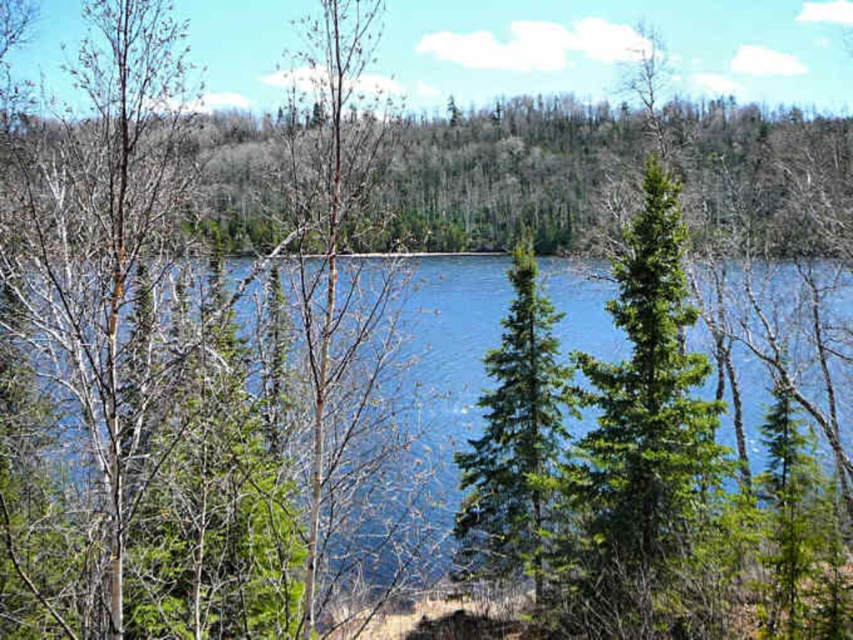
How much distance is there between blue liquid water at center and green needle-like tree at center?

blue liquid water at center and green needle-like tree at center are 11.91 meters apart from each other.

Does blue liquid water at center have a greater width compared to green needle-like tree at center?

Yes, blue liquid water at center is wider than green needle-like tree at center.

Is point (408, 333) in front of point (479, 496)?

Yes, point (408, 333) is closer to viewer.

The width and height of the screenshot is (853, 640). In order to click on blue liquid water at center in this screenshot , I will do `click(431, 385)`.